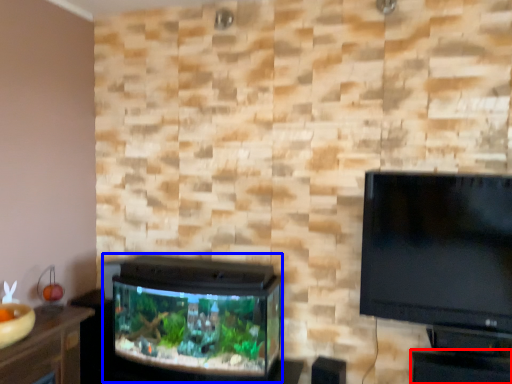
Question: Which object is further to the camera taking this photo, table (highlighted by a red box) or tv cabinet (highlighted by a blue box)?

Choices:
 (A) table
 (B) tv cabinet

Answer: (B)